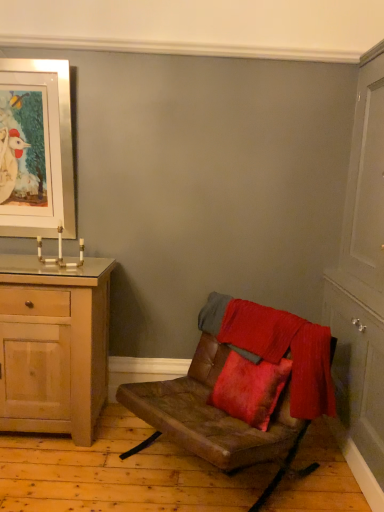
Find the location of `vacant region above silver metallic picture frame at upper left (from a real-world perspective)`. vacant region above silver metallic picture frame at upper left (from a real-world perspective) is located at coordinates (33, 61).